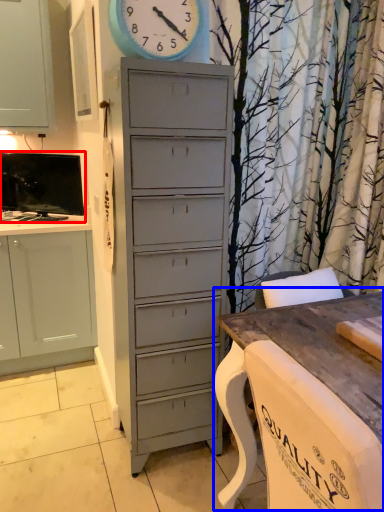
Question: Which object appears closest to the camera in this image, television (highlighted by a red box) or table (highlighted by a blue box)?

Choices:
 (A) television
 (B) table

Answer: (B)